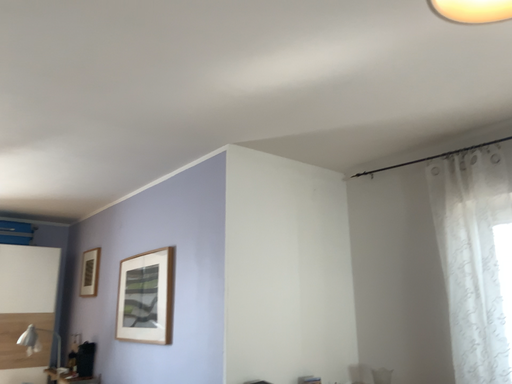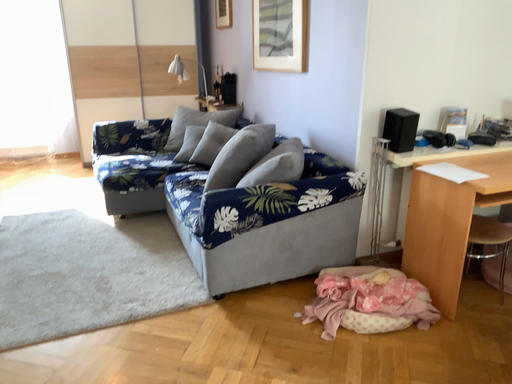
Question: Which way did the camera rotate in the video?

Choices:
 (A) rotated right
 (B) rotated left

Answer: (B)